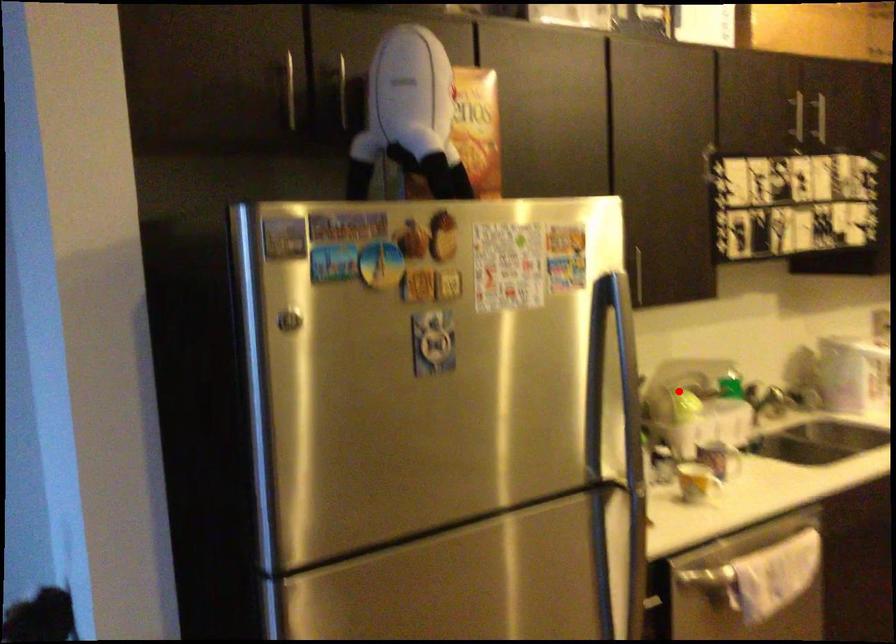
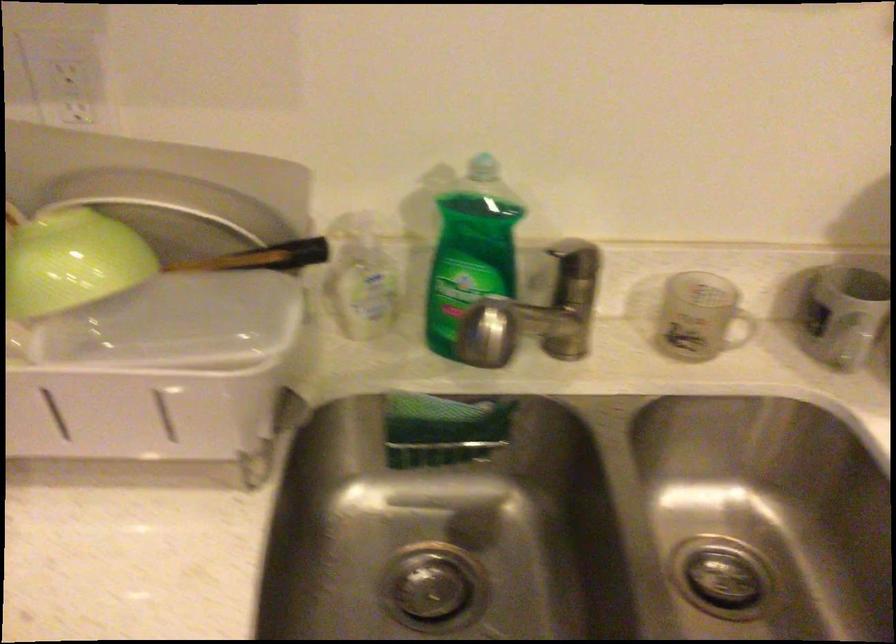
Where in the second image is the point corresponding to the highlighted location from the first image?

(71, 261)